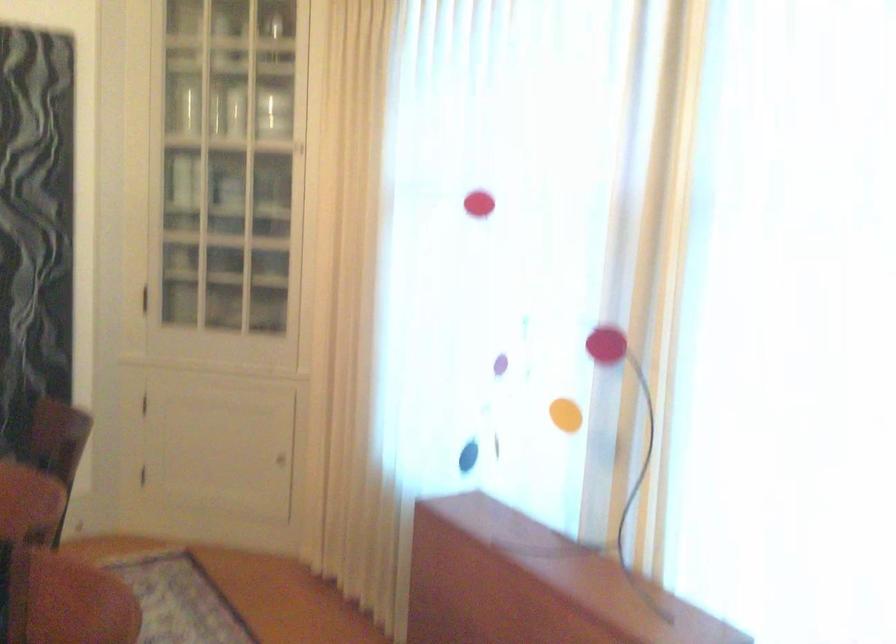
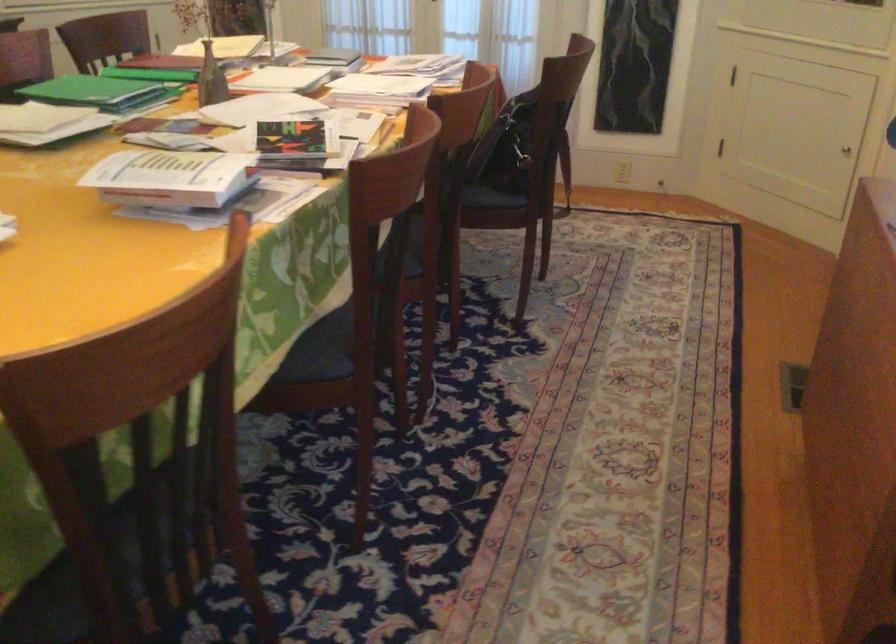
How did the camera likely rotate?

The rotation direction of the camera is left-down.